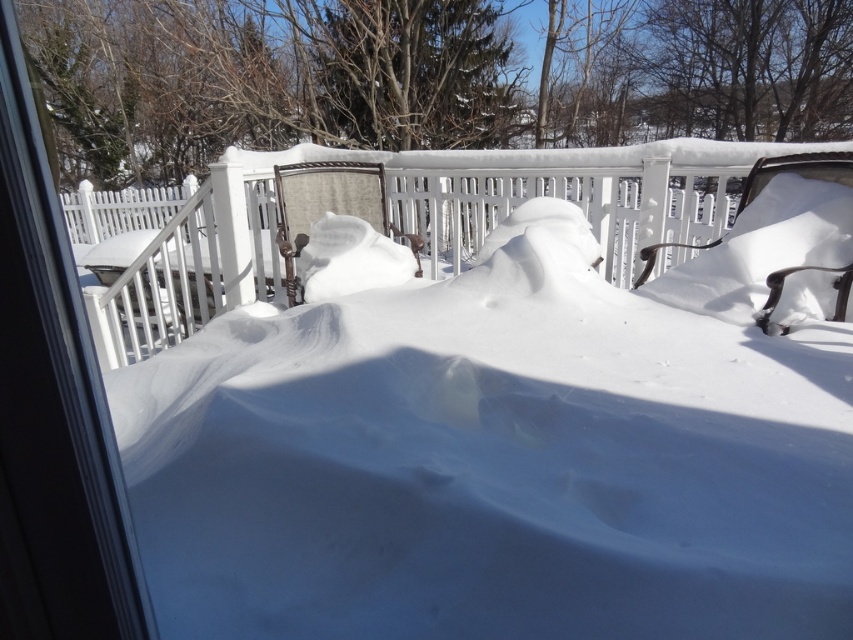
Does white wood fence at center appear under transparent plastic screen door at left?

Actually, white wood fence at center is above transparent plastic screen door at left.

Is point (206, 220) positioned after point (3, 17)?

Yes.

Find the location of a particular element. white wood fence at center is located at coordinates (393, 220).